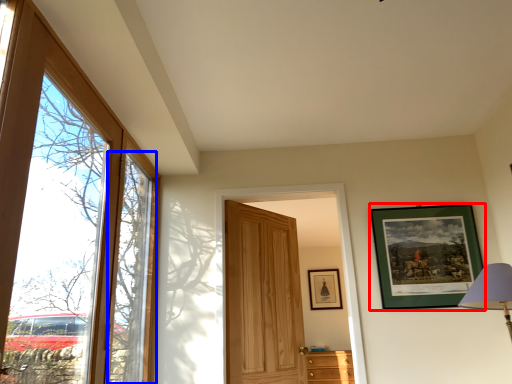
Question: Which object is closer to the camera taking this photo, picture frame (highlighted by a red box) or window (highlighted by a blue box)?

Choices:
 (A) picture frame
 (B) window

Answer: (B)